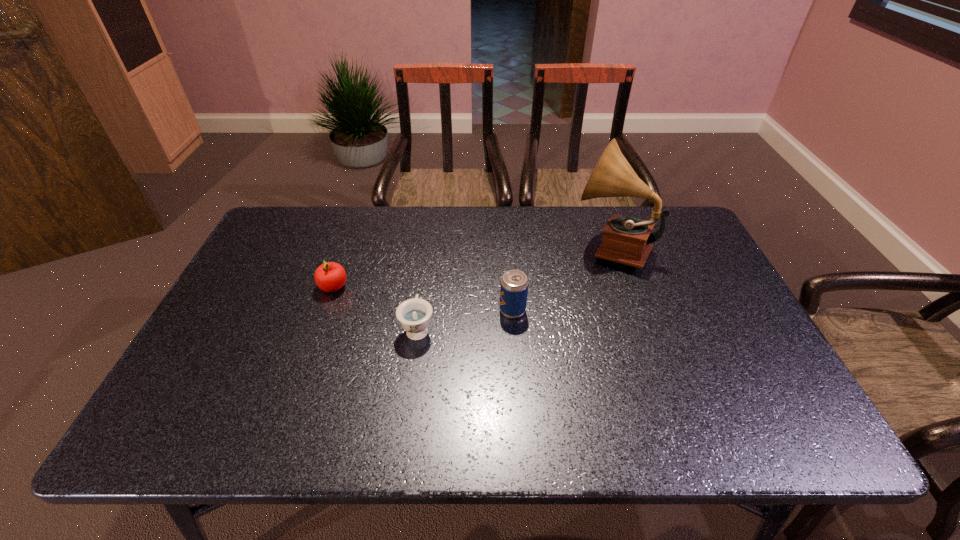
I want to click on blank area at the near edge, so click(351, 421).

Identify the location of vacant space at the left edge. This screenshot has width=960, height=540. (257, 256).

The image size is (960, 540). I want to click on vacant space at the far left corner of the desktop, so click(310, 210).

This screenshot has height=540, width=960. Identify the location of vacant space at the near left corner of the desktop. (x=200, y=426).

The image size is (960, 540). I want to click on vacant area that lies between the farthest object and the second farthest object, so click(472, 267).

Find the location of `vacant space in between the third nearest object and the beer can`. vacant space in between the third nearest object and the beer can is located at coordinates (423, 299).

Find the location of a particular element. The width and height of the screenshot is (960, 540). empty location between the shortest object and the third nearest object is located at coordinates (375, 308).

This screenshot has width=960, height=540. In order to click on free spot between the beer can and the shortest object in this screenshot , I will do `click(466, 319)`.

Locate an element on the screen. free space that is in between the teacup and the second farthest object is located at coordinates (375, 308).

The height and width of the screenshot is (540, 960). Find the location of `unoccupied position between the third shortest object and the apple`. unoccupied position between the third shortest object and the apple is located at coordinates (423, 299).